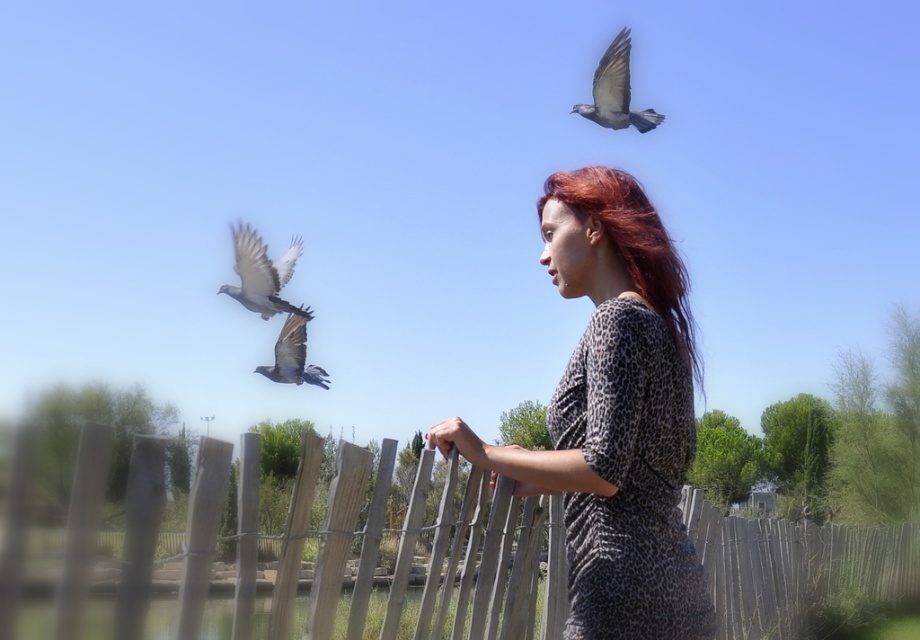
Based on the photo, you are an artist sketching the scene. You need to decide which object to draw first based on their sizes. Which one should you start with, the shiny red hair at center or the gray feathered pigeon at upper right?

The gray feathered pigeon at upper right should be drawn first because its width is larger than the shiny red hair at center.

You are standing in the scene and want to place a small flag at the point closer to you between point (690, 506) and point (297, 317). Which point should you choose?

You should choose point (690, 506) because it is closer to the camera than point (297, 317).

You are a photographer trying to capture a clear shot of the gray feathered bird at center without the wooden fence at center blocking the view. Based on the scene description, can you adjust your position to achieve this?

The wooden fence at center is larger in size than the gray feathered bird at center, so if you move your position to the side where the bird is flying towards, you can avoid the fence blocking the view.